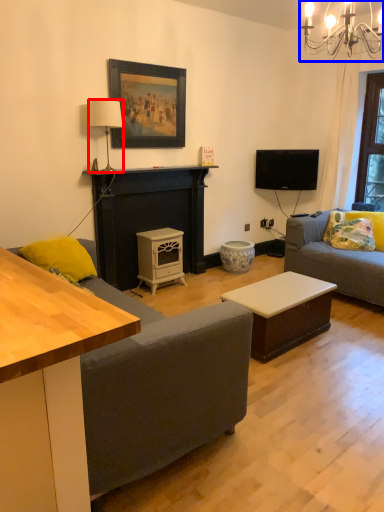
Question: Which object is closer to the camera taking this photo, lamp (highlighted by a red box) or light fixture (highlighted by a blue box)?

Choices:
 (A) lamp
 (B) light fixture

Answer: (B)